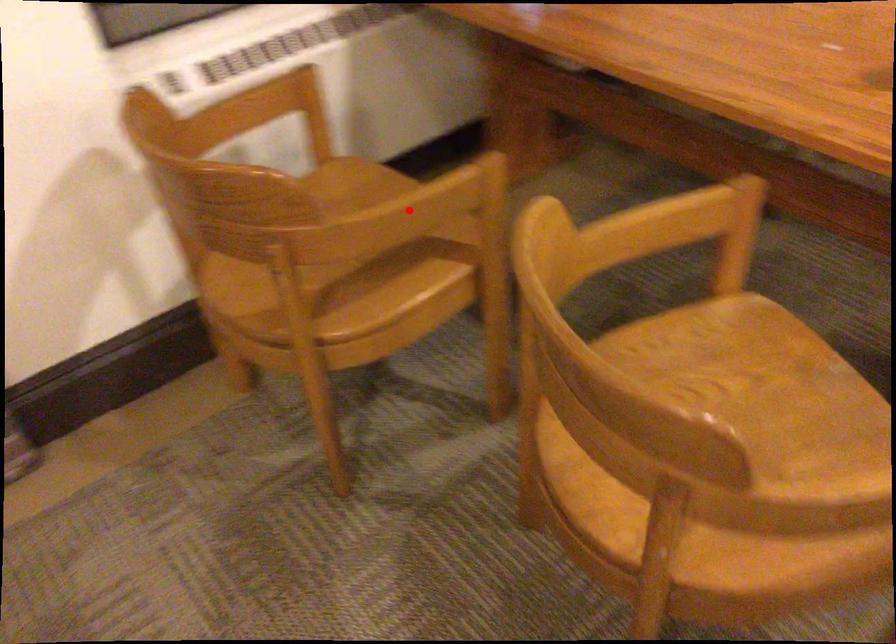
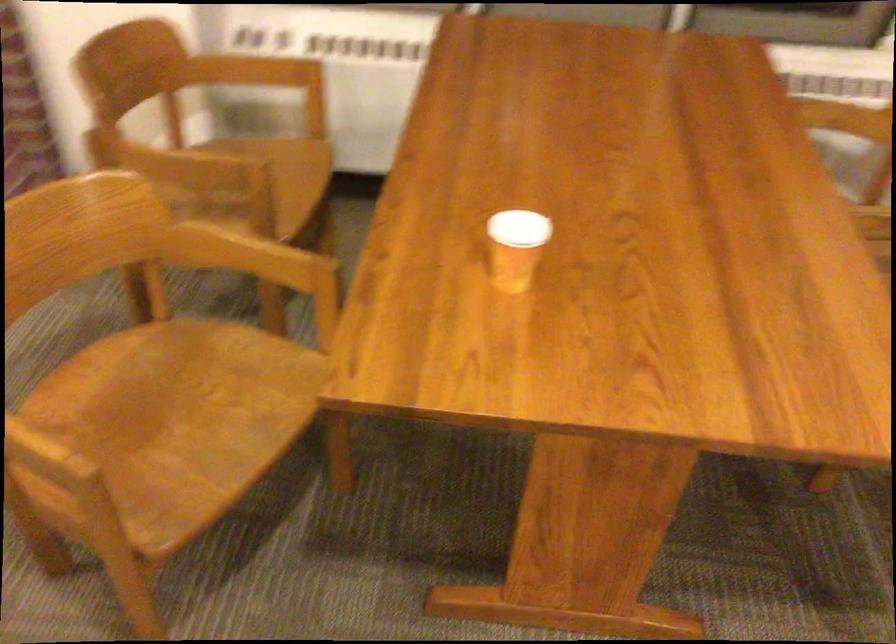
Where in the second image is the point corresponding to the highlighted location from the first image?

(169, 163)